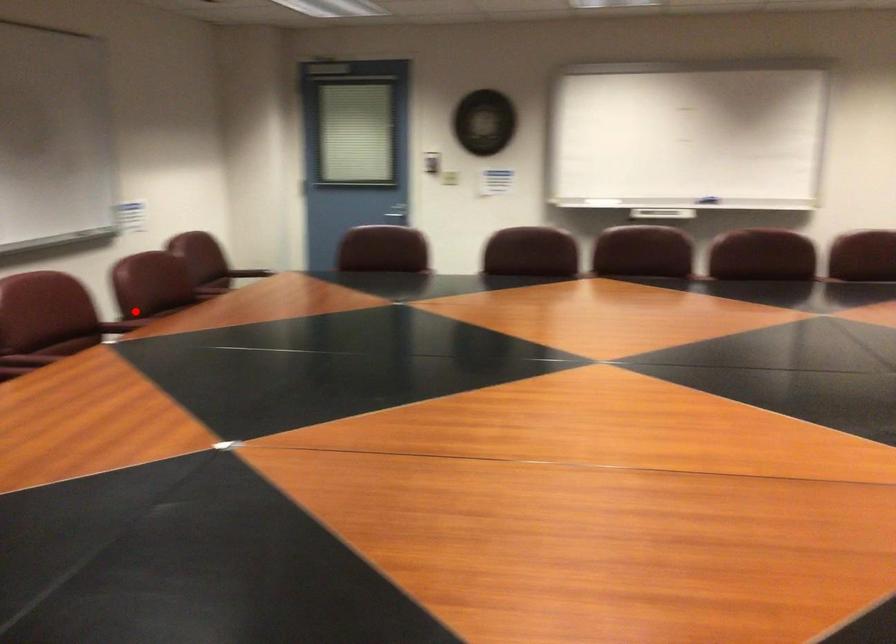
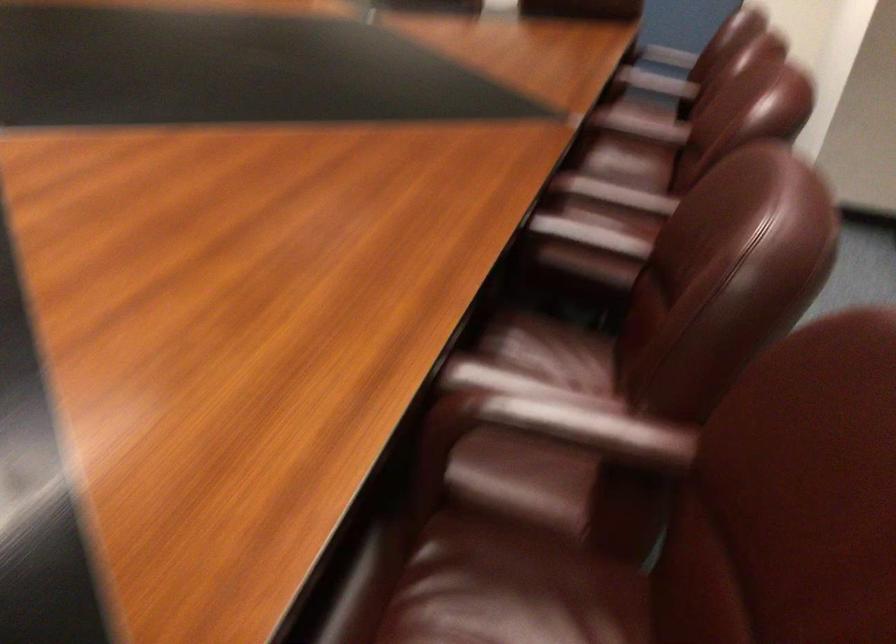
Question: A red point is marked in image1. In image2, is the corresponding 3D point closer to the camera or farther? Reply with the corresponding letter.

Choices:
 (A) The corresponding 3D point is closer.
 (B) The corresponding 3D point is farther.

Answer: (A)